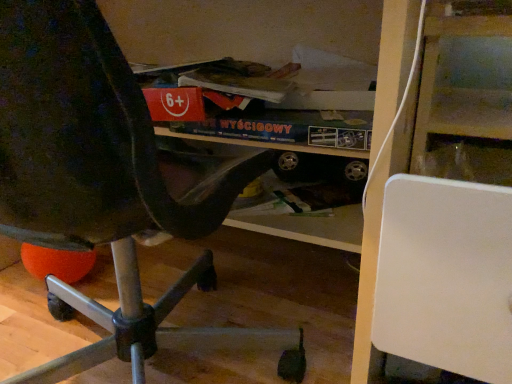
Describe the element at coordinates (106, 186) in the screenshot. This screenshot has width=512, height=384. I see `matte black chair at left` at that location.

Locate an element on the screen. matte black chair at left is located at coordinates (106, 186).

At what (x,y) coordinates should I click in order to perform the action: click on white matte board at right. Please return your answer as a coordinate pair (x, y). Looking at the image, I should click on (439, 232).

What is the approximate width of white matte board at right?

It is 14.55 inches.

Describe the element at coordinates (439, 232) in the screenshot. I see `white matte board at right` at that location.

You are a GUI agent. You are given a task and a screenshot of the screen. Output one action in this format:
    pyautogui.click(x=<x>, y=<y>)
    Task: Click on the matte black chair at left
    The height and width of the screenshot is (384, 512).
    Given the screenshot: What is the action you would take?
    pyautogui.click(x=106, y=186)

Consider the image. Which is more to the right, white matte board at right or matte black chair at left?

From the viewer's perspective, white matte board at right appears more on the right side.

In the image, is white matte board at right positioned in front of or behind matte black chair at left?

Visually, white matte board at right is located behind matte black chair at left.

Is point (496, 20) positioned behind point (133, 371)?

No.

Looking at this image, from the image's perspective, between white matte board at right and matte black chair at left, who is located below?

From the image's view, white matte board at right is below.

From a real-world perspective, is white matte board at right below matte black chair at left?

Yes, from a real-world perspective, white matte board at right is beneath matte black chair at left.

Which object is thinner, white matte board at right or matte black chair at left?

Thinner between the two is white matte board at right.

Between white matte board at right and matte black chair at left, which one has more height?

Standing taller between the two is white matte board at right.

Considering the relative sizes of white matte board at right and matte black chair at left in the image provided, is white matte board at right smaller than matte black chair at left?

Indeed, white matte board at right has a smaller size compared to matte black chair at left.

Would you say matte black chair at left is part of white matte board at right's contents?

No.

Would you consider white matte board at right to be distant from matte black chair at left?

No, there isn't a large distance between white matte board at right and matte black chair at left.

Is white matte board at right positioned with its back to matte black chair at left?

No, matte black chair at left is not at the back of white matte board at right.

How different are the orientations of white matte board at right and matte black chair at left in degrees?

The angle between the facing direction of white matte board at right and the facing direction of matte black chair at left is 176 degrees.

How far apart are white matte board at right and matte black chair at left?

They are 13.21 inches apart.

You are a GUI agent. You are given a task and a screenshot of the screen. Output one action in this format:
    pyautogui.click(x=<x>, y=<y>)
    Task: Click on the shelf below the matte black chair at left (from a real-world perspective)
    Image resolution: width=512 pixels, height=384 pixels.
    Given the screenshot: What is the action you would take?
    pyautogui.click(x=439, y=232)

Which object is positioned more to the left, matte black chair at left or white matte board at right?

From the viewer's perspective, matte black chair at left appears more on the left side.

Consider the image. Considering their positions, is matte black chair at left located in front of or behind white matte board at right?

matte black chair at left is in front of white matte board at right.

Is point (50, 82) less distant than point (382, 186)?

Yes.

From the image's perspective, who appears lower, matte black chair at left or white matte board at right?

white matte board at right appears lower in the image.

From a real-world perspective, is matte black chair at left positioned under white matte board at right based on gravity?

No.

In terms of width, does matte black chair at left look wider or thinner when compared to white matte board at right?

Considering their sizes, matte black chair at left looks broader than white matte board at right.

Considering the sizes of objects matte black chair at left and white matte board at right in the image provided, who is taller, matte black chair at left or white matte board at right?

Standing taller between the two is white matte board at right.

Can you confirm if matte black chair at left is bigger than white matte board at right?

Correct, matte black chair at left is larger in size than white matte board at right.

Is matte black chair at left located outside white matte board at right?

Yes.

Can you see matte black chair at left touching white matte board at right?

matte black chair at left is not next to white matte board at right, and they're not touching.

Is white matte board at right at the back of matte black chair at left?

That's not correct — matte black chair at left is not looking away from white matte board at right.

How far apart are matte black chair at left and white matte board at right?

matte black chair at left and white matte board at right are 13.21 inches apart from each other.

What are the coordinates of `chair in front of the white matte board at right` in the screenshot? It's located at (106, 186).

You are a GUI agent. You are given a task and a screenshot of the screen. Output one action in this format:
    pyautogui.click(x=<x>, y=<y>)
    Task: Click on the chair lying on the left of white matte board at right
    This screenshot has height=384, width=512.
    Given the screenshot: What is the action you would take?
    pyautogui.click(x=106, y=186)

The image size is (512, 384). I want to click on shelf that appears on the right of matte black chair at left, so click(x=439, y=232).